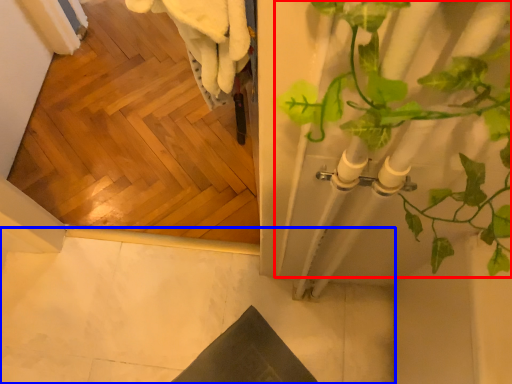
Question: Which object appears closest to the camera in this image, houseplant (highlighted by a red box) or concrete (highlighted by a blue box)?

Choices:
 (A) houseplant
 (B) concrete

Answer: (A)